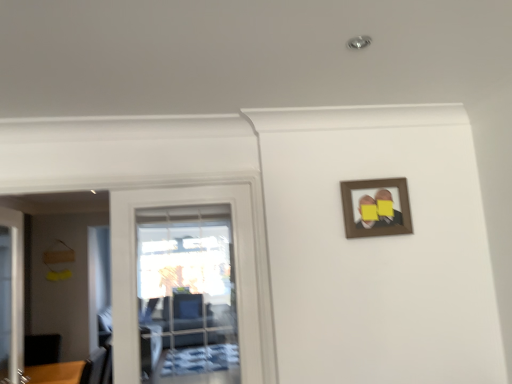
Describe the element at coordinates (136, 275) in the screenshot. The image size is (512, 384). I see `transparent glass door at left, which appears as the first door when viewed from the right` at that location.

What do you see at coordinates (14, 292) in the screenshot? This screenshot has height=384, width=512. I see `white glossy door at left, which ranks as the first door in left-to-right order` at bounding box center [14, 292].

What do you see at coordinates (376, 207) in the screenshot? I see `brown wooden picture frame at upper right` at bounding box center [376, 207].

Where is `transparent glass door at left, which is counted as the 2th door, starting from the left`? This screenshot has height=384, width=512. transparent glass door at left, which is counted as the 2th door, starting from the left is located at coordinates (136, 275).

From a real-world perspective, is brown wooden picture frame at upper right beneath transparent glass door at left, which is counted as the 2th door, starting from the left?

No, from a real-world perspective, brown wooden picture frame at upper right is not beneath transparent glass door at left, which is counted as the 2th door, starting from the left.

Is brown wooden picture frame at upper right oriented away from transparent glass door at left, which appears as the first door when viewed from the right?

No, transparent glass door at left, which appears as the first door when viewed from the right, is not at the back of brown wooden picture frame at upper right.

Are brown wooden picture frame at upper right and transparent glass door at left, which is counted as the 2th door, starting from the left, located far from each other?

That's not correct — brown wooden picture frame at upper right is a little close to transparent glass door at left, which is counted as the 2th door, starting from the left.

Does brown wooden picture frame at upper right have a greater width compared to transparent glass door at left, which appears as the first door when viewed from the right?

No, brown wooden picture frame at upper right is not wider than transparent glass door at left, which appears as the first door when viewed from the right.

Is the depth of transparent glass door at left, which is counted as the 2th door, starting from the left, greater than that of white glossy door at left, which ranks as the first door in left-to-right order?

No, transparent glass door at left, which is counted as the 2th door, starting from the left, is in front of white glossy door at left, which ranks as the first door in left-to-right order.

Locate an element on the screen. The width and height of the screenshot is (512, 384). door beneath the transparent glass door at left, which is counted as the 2th door, starting from the left (from a real-world perspective) is located at coordinates (14, 292).

Can you confirm if transparent glass door at left, which appears as the first door when viewed from the right, is wider than white glossy door at left, which is the second door from right to left?

No.

Considering the points (183, 187) and (7, 350), which point is behind, point (183, 187) or point (7, 350)?

Point (7, 350)

Is white glossy door at left, which is the second door from right to left, shorter than brown wooden picture frame at upper right?

In fact, white glossy door at left, which is the second door from right to left, may be taller than brown wooden picture frame at upper right.

Which of these two, white glossy door at left, which is the second door from right to left, or brown wooden picture frame at upper right, is wider?

white glossy door at left, which is the second door from right to left.

Can you tell me how much white glossy door at left, which ranks as the first door in left-to-right order, and brown wooden picture frame at upper right differ in facing direction?

91.5 degrees separate the facing orientations of white glossy door at left, which ranks as the first door in left-to-right order, and brown wooden picture frame at upper right.

Is the depth of white glossy door at left, which is the second door from right to left, less than that of brown wooden picture frame at upper right?

Yes, the depth of white glossy door at left, which is the second door from right to left, is less than that of brown wooden picture frame at upper right.

Is brown wooden picture frame at upper right bigger or smaller than white glossy door at left, which is the second door from right to left?

In the image, brown wooden picture frame at upper right appears to be smaller than white glossy door at left, which is the second door from right to left.

How different are the orientations of brown wooden picture frame at upper right and white glossy door at left, which is the second door from right to left, in degrees?

The facing directions of brown wooden picture frame at upper right and white glossy door at left, which is the second door from right to left, are 91.5 degrees apart.

From a real-world perspective, is brown wooden picture frame at upper right positioned under white glossy door at left, which ranks as the first door in left-to-right order, based on gravity?

No, from a real-world perspective, brown wooden picture frame at upper right is not beneath white glossy door at left, which ranks as the first door in left-to-right order.

At what (x,y) coordinates should I click in order to perform the action: click on the 2nd door positioned below the brown wooden picture frame at upper right (from a real-world perspective). Please return your answer as a coordinate pair (x, y). This screenshot has width=512, height=384. Looking at the image, I should click on (14, 292).

Consider the image. Who is bigger, white glossy door at left, which ranks as the first door in left-to-right order, or transparent glass door at left, which is counted as the 2th door, starting from the left?

white glossy door at left, which ranks as the first door in left-to-right order.

How many degrees apart are the facing directions of white glossy door at left, which is the second door from right to left, and transparent glass door at left, which is counted as the 2th door, starting from the left?

white glossy door at left, which is the second door from right to left, and transparent glass door at left, which is counted as the 2th door, starting from the left, are facing 91.5 degrees away from each other.

From the picture: Is white glossy door at left, which ranks as the first door in left-to-right order, positioned beyond the bounds of transparent glass door at left, which is counted as the 2th door, starting from the left?

Yes, white glossy door at left, which ranks as the first door in left-to-right order, is located beyond the bounds of transparent glass door at left, which is counted as the 2th door, starting from the left.

Is white glossy door at left, which ranks as the first door in left-to-right order, to the left of transparent glass door at left, which appears as the first door when viewed from the right, from the viewer's perspective?

Yes.

From the image's perspective, starting from the brown wooden picture frame at upper right, which door is the 1st one below? Please provide its 2D coordinates.

[(136, 275)]

How many degrees apart are the facing directions of transparent glass door at left, which appears as the first door when viewed from the right, and brown wooden picture frame at upper right?

The angle between the facing direction of transparent glass door at left, which appears as the first door when viewed from the right, and the facing direction of brown wooden picture frame at upper right is 0.00734 degrees.

Considering the sizes of objects transparent glass door at left, which appears as the first door when viewed from the right, and brown wooden picture frame at upper right in the image provided, who is shorter, transparent glass door at left, which appears as the first door when viewed from the right, or brown wooden picture frame at upper right?

Standing shorter between the two is brown wooden picture frame at upper right.

Considering the sizes of objects transparent glass door at left, which appears as the first door when viewed from the right, and brown wooden picture frame at upper right in the image provided, who is smaller, transparent glass door at left, which appears as the first door when viewed from the right, or brown wooden picture frame at upper right?

Smaller between the two is brown wooden picture frame at upper right.

At what (x,y) coordinates should I click in order to perform the action: click on picture frame on the right of transparent glass door at left, which appears as the first door when viewed from the right. Please return your answer as a coordinate pair (x, y). Image resolution: width=512 pixels, height=384 pixels. Looking at the image, I should click on (376, 207).

I want to click on door behind the transparent glass door at left, which is counted as the 2th door, starting from the left, so click(x=14, y=292).

Estimate the real-world distances between objects in this image. Which object is closer to brown wooden picture frame at upper right, white glossy door at left, which is the second door from right to left, or transparent glass door at left, which appears as the first door when viewed from the right?

transparent glass door at left, which appears as the first door when viewed from the right, lies closer to brown wooden picture frame at upper right than the other object.

In the scene shown: From the image, which object appears to be nearer to white glossy door at left, which is the second door from right to left, transparent glass door at left, which is counted as the 2th door, starting from the left, or brown wooden picture frame at upper right?

Based on the image, transparent glass door at left, which is counted as the 2th door, starting from the left, appears to be nearer to white glossy door at left, which is the second door from right to left.

Consider the image. Considering their positions, is white glossy door at left, which is the second door from right to left, positioned closer to transparent glass door at left, which is counted as the 2th door, starting from the left, than brown wooden picture frame at upper right?

The object closer to transparent glass door at left, which is counted as the 2th door, starting from the left, is brown wooden picture frame at upper right.

When comparing their distances from brown wooden picture frame at upper right, does transparent glass door at left, which appears as the first door when viewed from the right, or white glossy door at left, which is the second door from right to left, seem closer?

The object closer to brown wooden picture frame at upper right is transparent glass door at left, which appears as the first door when viewed from the right.

Based on their spatial positions, is brown wooden picture frame at upper right or white glossy door at left, which is the second door from right to left, further from transparent glass door at left, which is counted as the 2th door, starting from the left?

white glossy door at left, which is the second door from right to left.

Estimate the real-world distances between objects in this image. Which object is further from white glossy door at left, which is the second door from right to left, brown wooden picture frame at upper right or transparent glass door at left, which is counted as the 2th door, starting from the left?

brown wooden picture frame at upper right is further to white glossy door at left, which is the second door from right to left.

The width and height of the screenshot is (512, 384). I want to click on door situated between white glossy door at left, which ranks as the first door in left-to-right order, and brown wooden picture frame at upper right from left to right, so click(x=136, y=275).